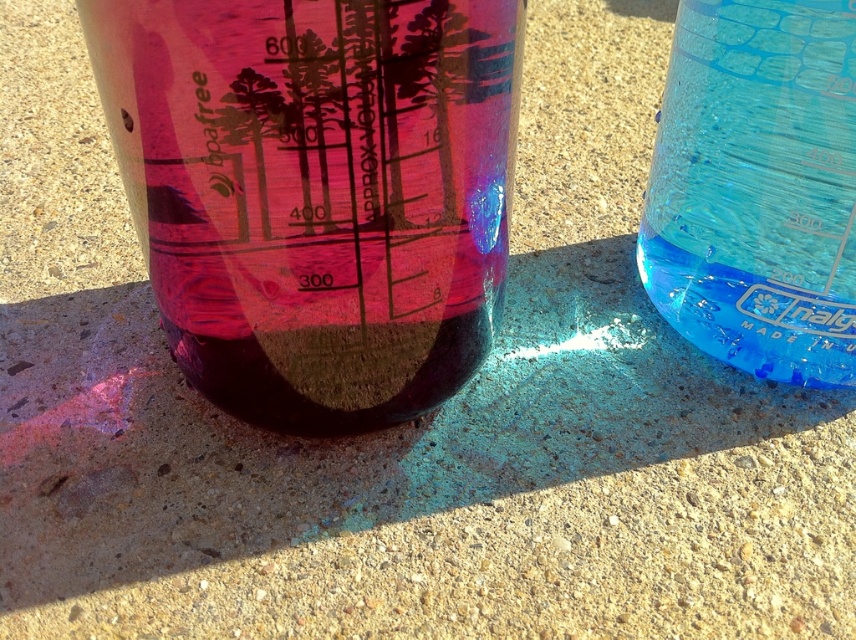
You are a scientist who needs to pour the contents of both transparent plastic beaker at left and transparent blue beaker at right into a larger container. Based on the scene, which beaker should you pour first to ensure the total volume doesn

The transparent plastic beaker at left is below the transparent blue beaker at right, so pouring the transparent blue beaker at right first would prevent spillage caused by the lower positioned beaker obstructing the flow.

You are a scientist who needs to pour the contents of the transparent plastic beaker at left into the transparent blue beaker at right. Based on their positions, will the blue beaker at right be able to hold all the liquid from the left beaker without spilling?

The transparent plastic beaker at left is to the left of the transparent blue beaker at right, but their positions do not indicate their capacities. The red liquid in the left beaker is at 400 ml, and the blue beaker has 200 ml. Pouring 400 ml into the blue beaker would exceed its current volume, but without knowing its total capacity, we cannot confirm if it will spill. However, since both have markings up to 600 ml, the blue beaker likely can hold the combined 600 ml safely.

You are a scientist who needs to pour the contents of the transparent plastic beaker at left into the transparent blue beaker at right. Given that the blue beaker has a capacity of 300 ml, will there be enough space to hold the entire 400 ml from the left beaker?

The transparent blue beaker at right has a capacity of 300 ml, but the transparent plastic beaker at left contains 400 ml. Pouring the entire 400 ml would exceed the blue beaker capacity, so there won